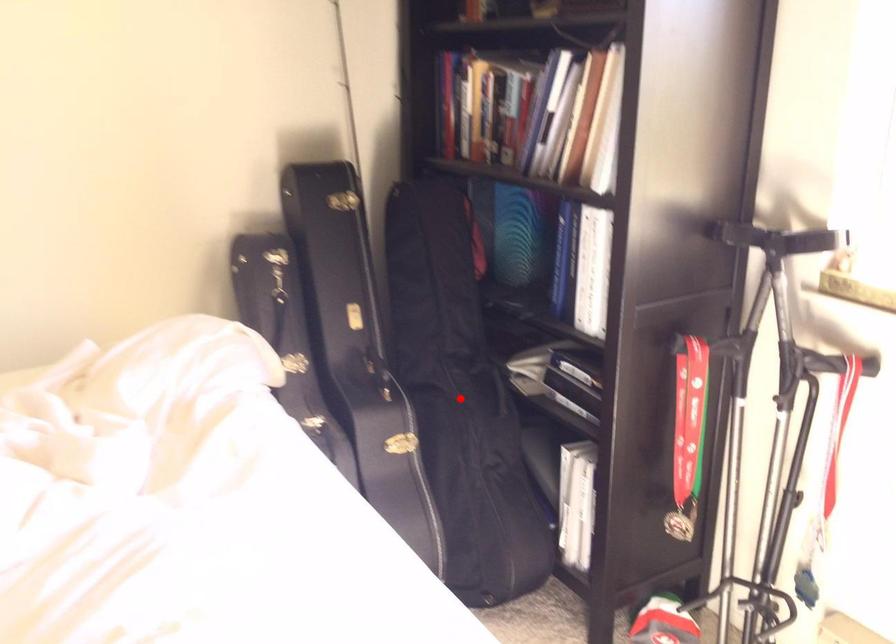
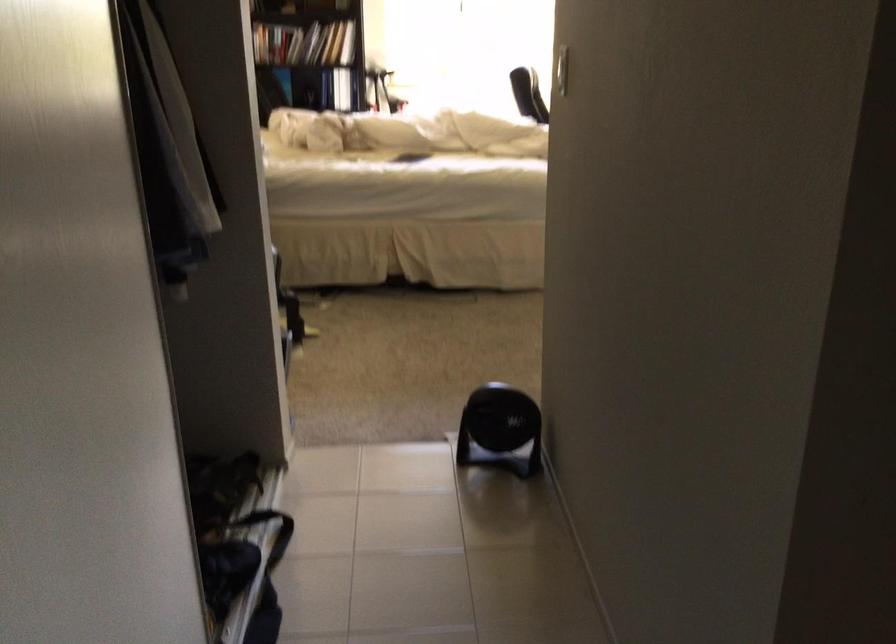
Question: I am providing you with two images of the same scene from different viewpoints. A red point is marked on the first image. Is the red point's position out of view in image 2?

Choices:
 (A) Yes
 (B) No

Answer: (A)